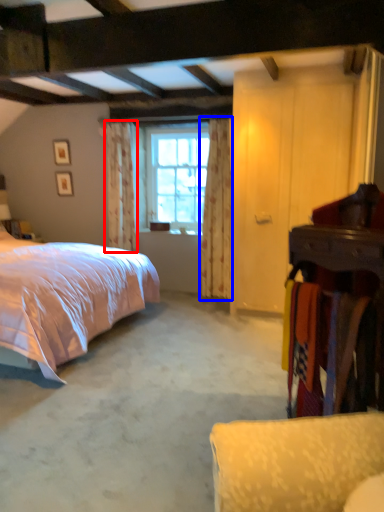
Question: Which object appears closest to the camera in this image, curtain (highlighted by a red box) or curtain (highlighted by a blue box)?

Choices:
 (A) curtain
 (B) curtain

Answer: (B)